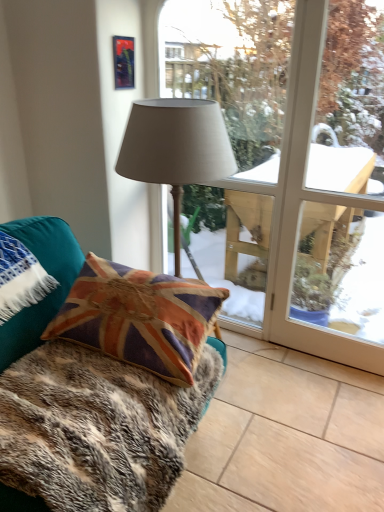
Question: Does point (208, 117) appear closer or farther from the camera than point (210, 195)?

Choices:
 (A) closer
 (B) farther

Answer: (A)

Question: Considering their positions, is matte gray fabric lamp at center located in front of or behind matte gray lampshade at center?

Choices:
 (A) front
 (B) behind

Answer: (A)

Question: Which of these objects is positioned farthest from the matte gray lampshade at center?

Choices:
 (A) fur-like fabric at lower left
 (B) velvet union jack pillow at left
 (C) metallic reflective picture frame at upper center
 (D) matte gray fabric lamp at center
 (E) velvet union jack pillow at lower left

Answer: (E)

Question: Which of these objects is positioned closest to the velvet union jack pillow at lower left?

Choices:
 (A) fur-like fabric at lower left
 (B) velvet union jack pillow at left
 (C) matte gray lampshade at center
 (D) matte gray fabric lamp at center
 (E) metallic reflective picture frame at upper center

Answer: (B)